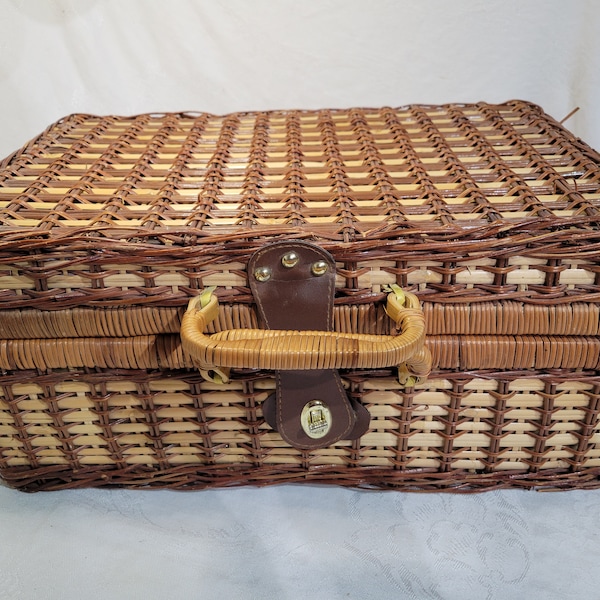
Where is `basket style case`? basket style case is located at coordinates (384, 174).